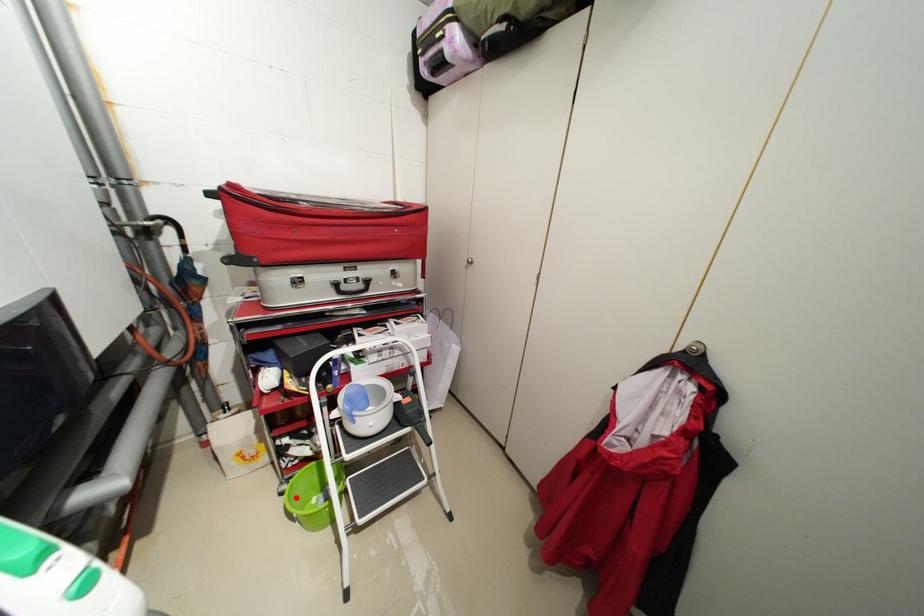
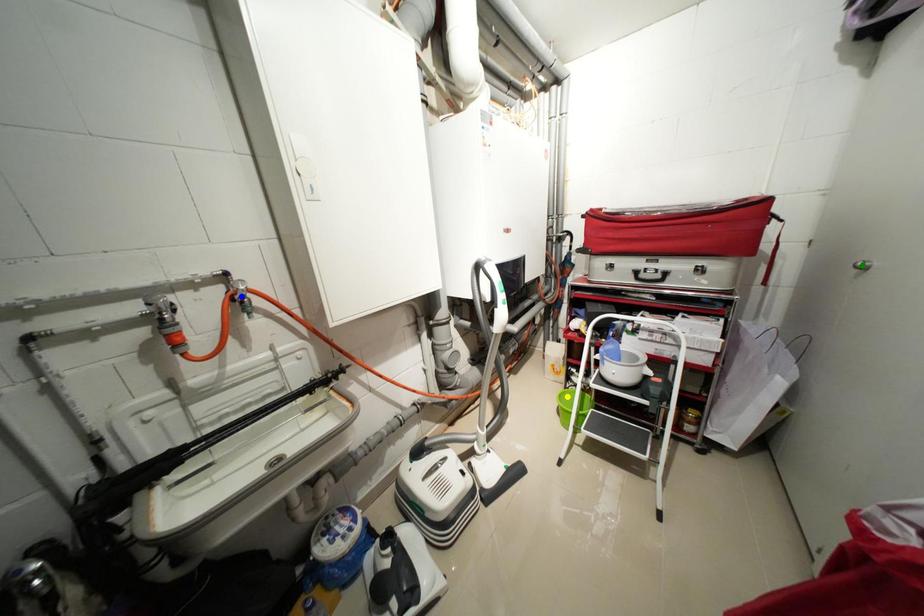
Question: I am providing you with two images of the same scene from different viewpoints. A red point is marked on the first image. You are given multiple points on the second image. Which point in image 2 is actually the same real-world point as the red point in image 1?

Choices:
 (A) yellow point
 (B) blue point
 (C) green point

Answer: (A)